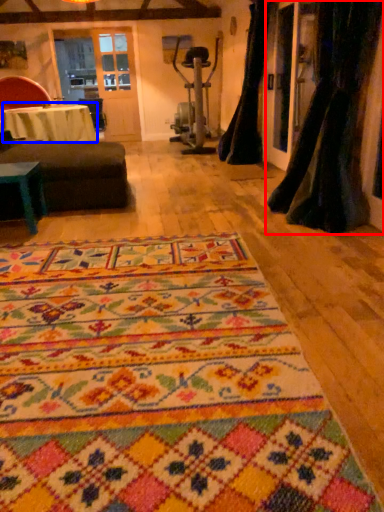
Question: Which point is further to the camera, curtain (highlighted by a red box) or table (highlighted by a blue box)?

Choices:
 (A) curtain
 (B) table

Answer: (B)